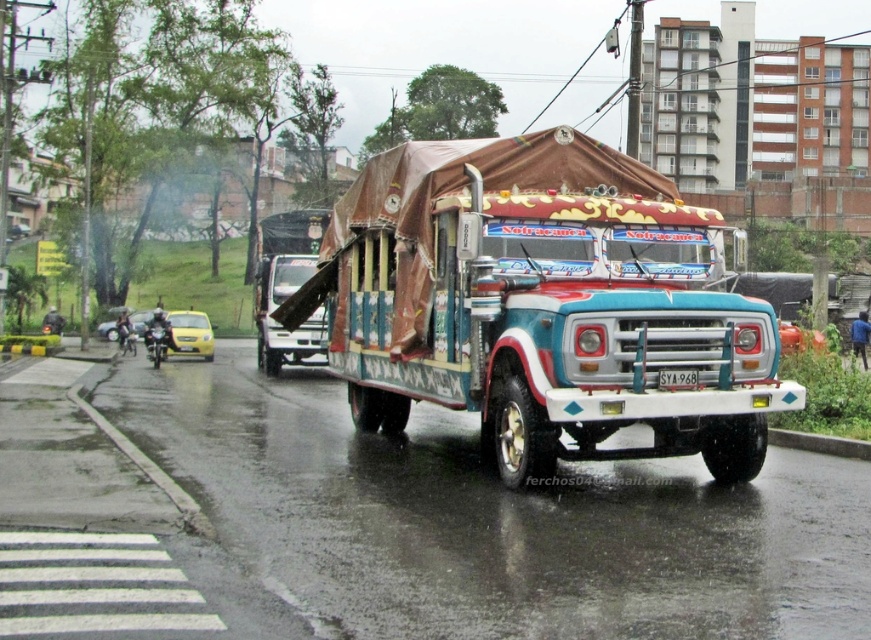
Which of these two, painted wood truck at center or wooden planks at center, stands shorter?

With less height is painted wood truck at center.

Is painted wood truck at center shorter than wooden planks at center?

Correct, painted wood truck at center is not as tall as wooden planks at center.

Between point (356, 330) and point (267, 241), which one is positioned in front?

Point (356, 330) is in front.

Find the location of `painted wood truck at center`. painted wood truck at center is located at coordinates (542, 305).